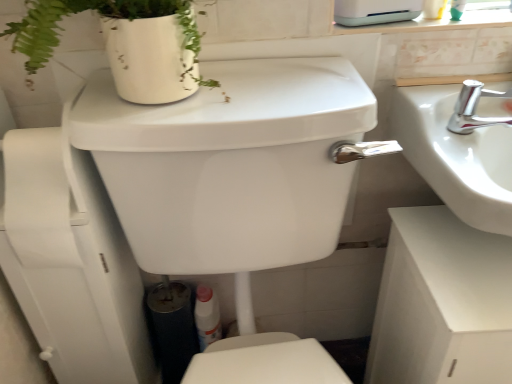
What do you see at coordinates (460, 148) in the screenshot? This screenshot has height=384, width=512. I see `white glossy sink at right` at bounding box center [460, 148].

Where is `white glossy sink at right`? This screenshot has height=384, width=512. white glossy sink at right is located at coordinates (460, 148).

You are a GUI agent. You are given a task and a screenshot of the screen. Output one action in this format:
    pyautogui.click(x=<x>, y=<y>)
    Task: Click on the silver metallic faucet at upper right
    The width and height of the screenshot is (512, 384).
    Given the screenshot: What is the action you would take?
    pyautogui.click(x=474, y=109)

From a real-world perspective, which is physically above, white plastic bottle at lower center or white glossy sink at right?

white glossy sink at right, from a real-world perspective.

You are a GUI agent. You are given a task and a screenshot of the screen. Output one action in this format:
    pyautogui.click(x=<x>, y=<y>)
    Task: Click on the toiletry that appears below the white glossy sink at right (from a real-world perspective)
    The width and height of the screenshot is (512, 384).
    Given the screenshot: What is the action you would take?
    pyautogui.click(x=207, y=316)

Which is more to the left, white plastic bottle at lower center or white glossy sink at right?

From the viewer's perspective, white plastic bottle at lower center appears more on the left side.

From the image's perspective, is white plastic bottle at lower center located above or below white glossy sink at right?

white plastic bottle at lower center is below white glossy sink at right.

Is white matte cabinet at lower right wider or thinner than white plastic bottle at lower center?

white matte cabinet at lower right is wider than white plastic bottle at lower center.

Between white matte cabinet at lower right and white plastic bottle at lower center, which one has more height?

white matte cabinet at lower right.

Would you say white matte cabinet at lower right contains white plastic bottle at lower center?

Actually, white plastic bottle at lower center is outside white matte cabinet at lower right.

Are white glossy appliance at upper center and white glossy sink at right beside each other?

No, white glossy appliance at upper center is not beside white glossy sink at right.

How much distance is there between white glossy appliance at upper center and white glossy sink at right?

They are 9.86 inches apart.

Based on the photo, who is shorter, white glossy appliance at upper center or white glossy sink at right?

With less height is white glossy sink at right.

Can you confirm if white glossy appliance at upper center is bigger than white glossy sink at right?

Incorrect, white glossy appliance at upper center is not larger than white glossy sink at right.

Is white glossy appliance at upper center facing away from white matte cabinet at lower right?

That's not correct — white glossy appliance at upper center is not looking away from white matte cabinet at lower right.

Considering the points (414, 0) and (505, 256), which point is behind, point (414, 0) or point (505, 256)?

The point (414, 0) is behind.

Looking at this image, between white glossy appliance at upper center and white matte cabinet at lower right, which one appears on the left side from the viewer's perspective?

Positioned to the left is white glossy appliance at upper center.

Is white glossy appliance at upper center bigger or smaller than white matte cabinet at lower right?

Clearly, white glossy appliance at upper center is smaller in size than white matte cabinet at lower right.

Does point (488, 238) come farther from viewer compared to point (498, 156)?

That is True.

From a real-world perspective, is white matte cabinet at lower right positioned above or below white glossy sink at right?

white matte cabinet at lower right is situated lower than white glossy sink at right in the real world.

Looking at the image, does white matte cabinet at lower right seem bigger or smaller compared to white glossy sink at right?

In the image, white matte cabinet at lower right appears to be larger than white glossy sink at right.

Is white matte cabinet at lower right oriented towards white glossy sink at right?

No.

Is white plastic bottle at lower center facing away from white glossy appliance at upper center?

white plastic bottle at lower center is not turned away from white glossy appliance at upper center.

From the image's perspective, is white plastic bottle at lower center above white glossy appliance at upper center?

No, from the image's perspective, white plastic bottle at lower center is not over white glossy appliance at upper center.

Is white plastic bottle at lower center taller or shorter than white glossy appliance at upper center?

In the image, white plastic bottle at lower center appears to be taller than white glossy appliance at upper center.

I want to click on toiletry that appears on the left of white glossy appliance at upper center, so click(207, 316).

How distant is silver metallic faucet at upper right from white glossy sink at right?

silver metallic faucet at upper right and white glossy sink at right are 2.44 inches apart.

Is silver metallic faucet at upper right positioned with its back to white glossy sink at right?

Yes, silver metallic faucet at upper right is facing away from white glossy sink at right.

Does point (479, 117) appear closer or farther from the camera than point (511, 150)?

Point (479, 117) is farther from the camera than point (511, 150).

Does silver metallic faucet at upper right have a lesser width compared to white glossy sink at right?

Yes, silver metallic faucet at upper right is thinner than white glossy sink at right.

Find the location of a particular element. The height and width of the screenshot is (384, 512). sink above the white plastic bottle at lower center (from the image's perspective) is located at coordinates (460, 148).

The height and width of the screenshot is (384, 512). Identify the location of toiletry behind the white matte cabinet at lower right. (207, 316).

Looking at the image, which one is located closer to white matte cabinet at lower right, white glossy sink at right or white glossy appliance at upper center?

Based on the image, white glossy sink at right appears to be nearer to white matte cabinet at lower right.

Based on the photo, considering their positions, is silver metallic faucet at upper right positioned further to white matte cabinet at lower right than white plastic bottle at lower center?

Among the two, white plastic bottle at lower center is located further to white matte cabinet at lower right.

Estimate the real-world distances between objects in this image. Which object is closer to white glossy sink at right, white matte cabinet at lower right or silver metallic faucet at upper right?

silver metallic faucet at upper right.

Based on their spatial positions, is white glossy sink at right or silver metallic faucet at upper right closer to white plastic bottle at lower center?

Among the two, white glossy sink at right is located nearer to white plastic bottle at lower center.

From the image, which object appears to be nearer to white glossy sink at right, white matte cabinet at lower right or white plastic bottle at lower center?

Based on the image, white matte cabinet at lower right appears to be nearer to white glossy sink at right.

When comparing their distances from silver metallic faucet at upper right, does white plastic bottle at lower center or white matte cabinet at lower right seem further?

Among the two, white plastic bottle at lower center is located further to silver metallic faucet at upper right.

Considering their positions, is silver metallic faucet at upper right positioned further to white glossy sink at right than white glossy appliance at upper center?

The object further to white glossy sink at right is white glossy appliance at upper center.

When comparing their distances from white plastic bottle at lower center, does silver metallic faucet at upper right or white glossy appliance at upper center seem closer?

Based on the image, silver metallic faucet at upper right appears to be nearer to white plastic bottle at lower center.

Locate an element on the screen. Image resolution: width=512 pixels, height=384 pixels. sink between white plastic bottle at lower center and white matte cabinet at lower right from left to right is located at coordinates 460,148.

Image resolution: width=512 pixels, height=384 pixels. Find the location of `counter top that lies between white glossy appliance at upper center and white plastic bottle at lower center from top to bottom`. counter top that lies between white glossy appliance at upper center and white plastic bottle at lower center from top to bottom is located at coordinates (442, 303).

I want to click on sink between white glossy appliance at upper center and white matte cabinet at lower right in the vertical direction, so click(460, 148).

Find the location of a particular element. tap between white glossy appliance at upper center and white glossy sink at right vertically is located at coordinates (474, 109).